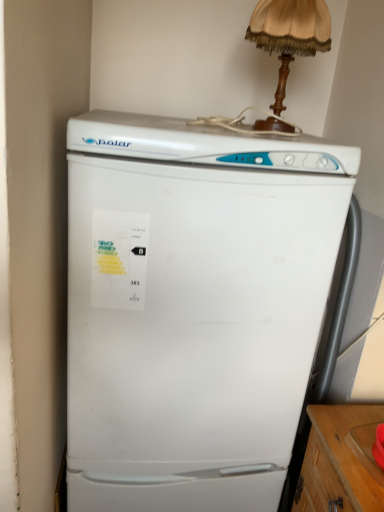
Question: Considering the positions of wooden table lamp at upper center and white matte refrigerator at center in the image, is wooden table lamp at upper center bigger or smaller than white matte refrigerator at center?

Choices:
 (A) small
 (B) big

Answer: (A)

Question: Considering the positions of wooden table lamp at upper center and white matte refrigerator at center in the image, is wooden table lamp at upper center wider or thinner than white matte refrigerator at center?

Choices:
 (A) wide
 (B) thin

Answer: (B)

Question: Visually, is wooden table lamp at upper center positioned to the left or to the right of white matte refrigerator at center?

Choices:
 (A) left
 (B) right

Answer: (B)

Question: From the image's perspective, relative to wooden table lamp at upper center, is white matte refrigerator at center above or below?

Choices:
 (A) above
 (B) below

Answer: (B)

Question: Considering the positions of white matte refrigerator at center and wooden table lamp at upper center in the image, is white matte refrigerator at center taller or shorter than wooden table lamp at upper center?

Choices:
 (A) tall
 (B) short

Answer: (A)

Question: Considering their positions, is white matte refrigerator at center located in front of or behind wooden table lamp at upper center?

Choices:
 (A) behind
 (B) front

Answer: (B)

Question: Is white matte refrigerator at center inside the boundaries of wooden table lamp at upper center, or outside?

Choices:
 (A) outside
 (B) inside

Answer: (A)